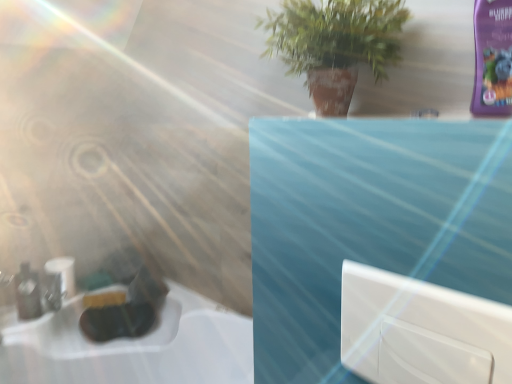
Question: Looking at their shapes, would you say matte black bottle at left is wider or thinner than white matte toilet paper at lower left?

Choices:
 (A) thin
 (B) wide

Answer: (A)

Question: Considering their positions, is matte black bottle at left located in front of or behind white matte toilet paper at lower left?

Choices:
 (A) behind
 (B) front

Answer: (B)

Question: Considering the real-world distances, which object is farthest from the matte black bottle at left?

Choices:
 (A) green matte plant at upper center
 (B) white matte toilet paper at lower left
 (C) white glossy window at center

Answer: (C)

Question: Estimate the real-world distances between objects in this image. Which object is farther from the matte black bottle at left?

Choices:
 (A) white matte toilet paper at lower left
 (B) green matte plant at upper center
 (C) white glossy window at center

Answer: (C)